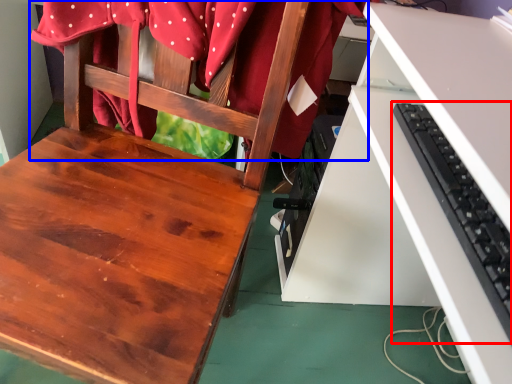
Question: Among these objects, which one is farthest to the camera, computer keyboard (highlighted by a red box) or fabric (highlighted by a blue box)?

Choices:
 (A) computer keyboard
 (B) fabric

Answer: (B)